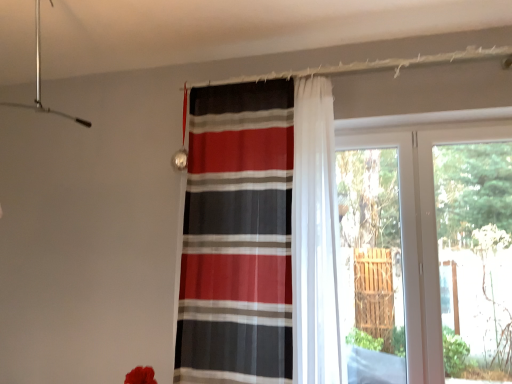
Question: Is transparent glass door at right oriented away from transparent glass screen door at right?

Choices:
 (A) yes
 (B) no

Answer: (B)

Question: From a real-world perspective, is transparent glass door at right located beneath transparent glass screen door at right?

Choices:
 (A) no
 (B) yes

Answer: (A)

Question: From a real-world perspective, is transparent glass door at right over transparent glass screen door at right?

Choices:
 (A) yes
 (B) no

Answer: (A)

Question: Is transparent glass door at right positioned behind transparent glass screen door at right?

Choices:
 (A) no
 (B) yes

Answer: (A)

Question: Does transparent glass door at right have a lesser width compared to transparent glass screen door at right?

Choices:
 (A) no
 (B) yes

Answer: (B)

Question: From the image's perspective, is transparent glass door at right over transparent glass screen door at right?

Choices:
 (A) no
 (B) yes

Answer: (B)

Question: Is transparent glass door at right far from striped fabric curtain at center?

Choices:
 (A) no
 (B) yes

Answer: (A)

Question: Can you confirm if transparent glass door at right is positioned to the left of striped fabric curtain at center?

Choices:
 (A) yes
 (B) no

Answer: (B)

Question: Would you say transparent glass door at right is outside striped fabric curtain at center?

Choices:
 (A) yes
 (B) no

Answer: (A)

Question: Does transparent glass door at right contain striped fabric curtain at center?

Choices:
 (A) no
 (B) yes

Answer: (A)

Question: Is transparent glass door at right positioned behind striped fabric curtain at center?

Choices:
 (A) yes
 (B) no

Answer: (A)

Question: Is transparent glass door at right aimed at striped fabric curtain at center?

Choices:
 (A) no
 (B) yes

Answer: (A)

Question: Considering the relative sizes of striped fabric curtain at center and transparent glass door at right in the image provided, is striped fabric curtain at center wider than transparent glass door at right?

Choices:
 (A) no
 (B) yes

Answer: (B)